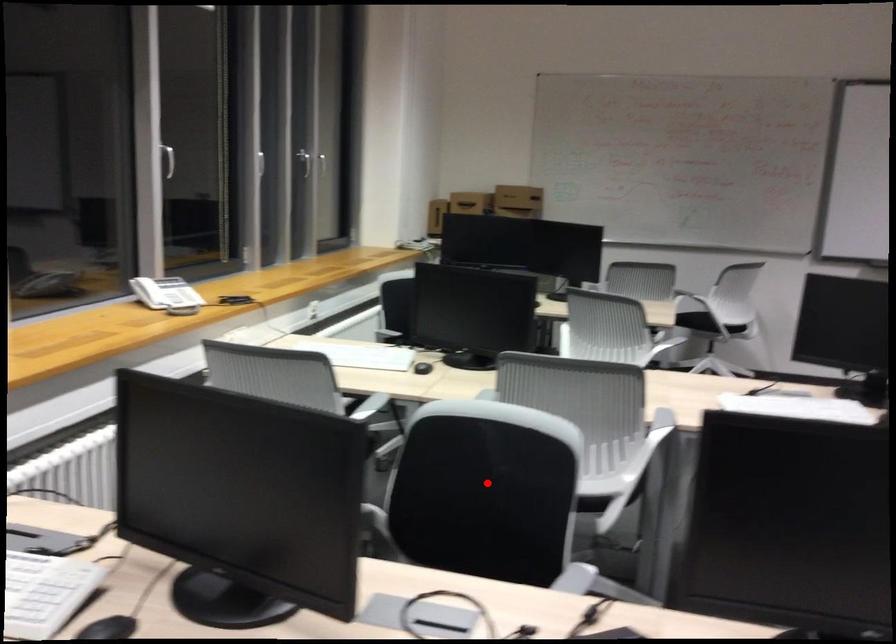
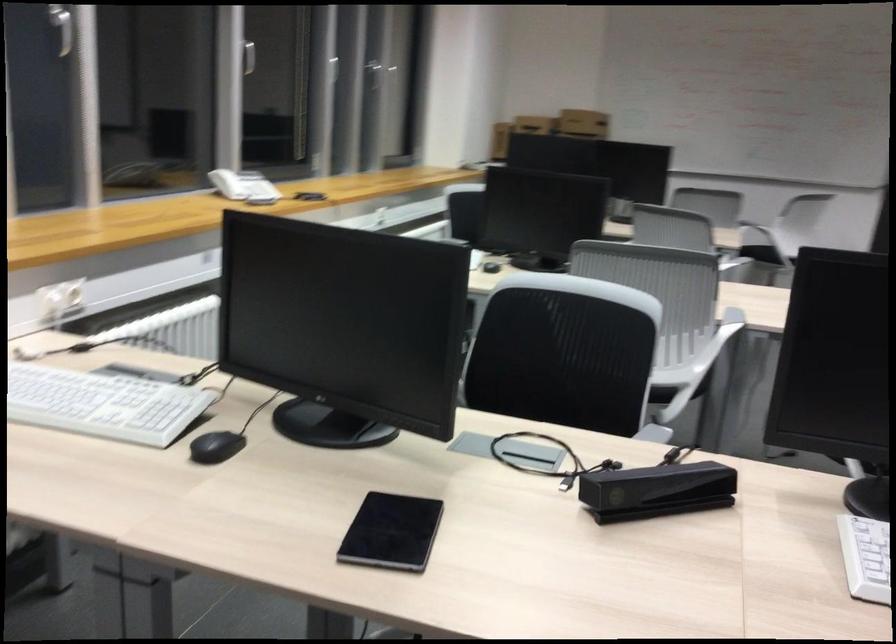
In the second image, find the point that corresponds to the highlighted location in the first image.

(564, 353)